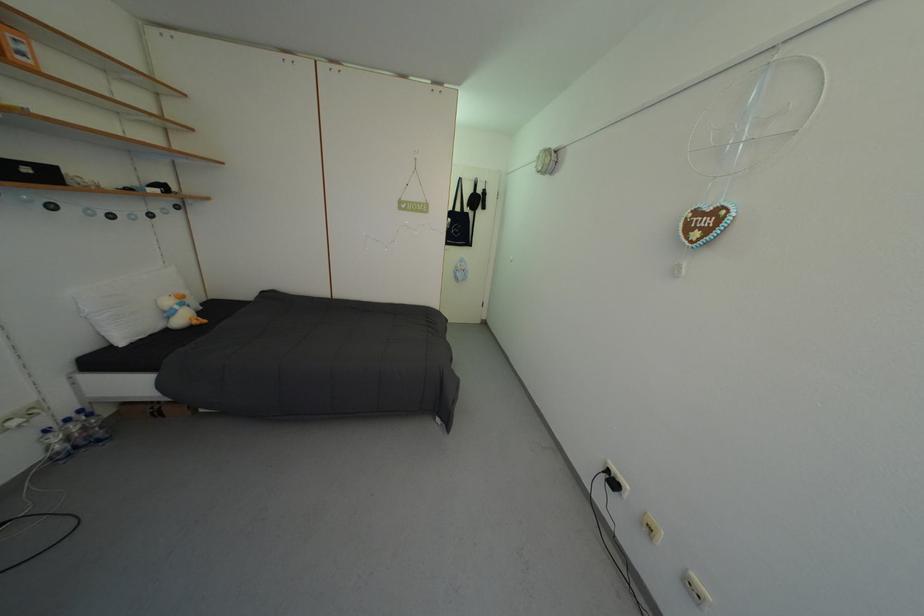
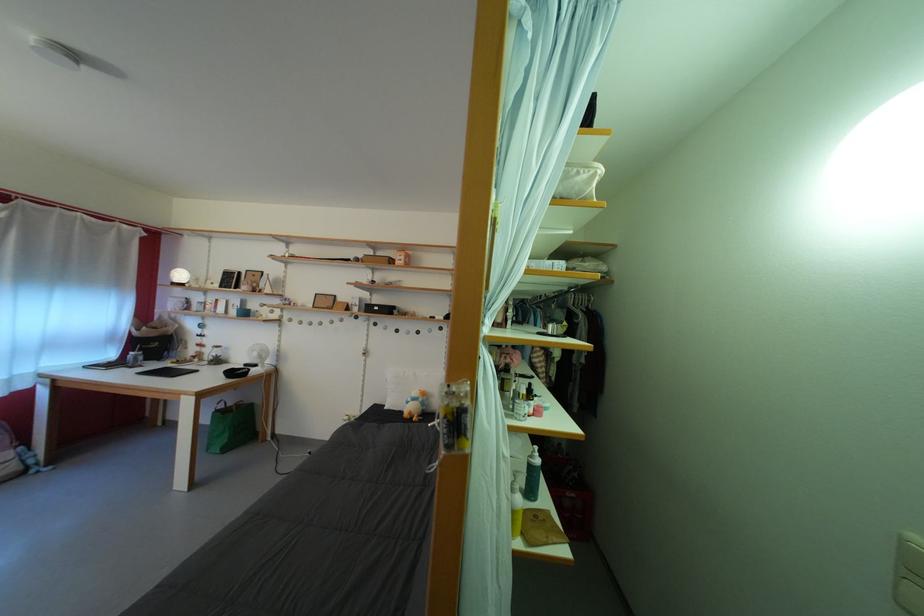
In the second image, find the point that corresponds to [35,176] in the first image.

(384, 314)